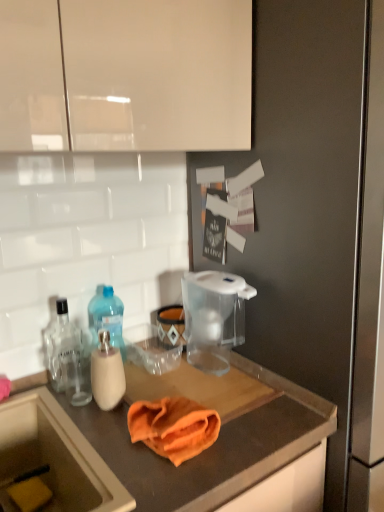
Question: Considering the positions of orange fabric at center and translucent plastic bottle at left, the 1th bottle positioned from the right, in the image, is orange fabric at center wider or thinner than translucent plastic bottle at left, the 1th bottle positioned from the right,?

Choices:
 (A) thin
 (B) wide

Answer: (B)

Question: In the image, is orange fabric at center positioned in front of or behind translucent plastic bottle at left, which is the second bottle in left-to-right order?

Choices:
 (A) behind
 (B) front

Answer: (B)

Question: Based on their relative distances, which object is nearer to the yellow sponge at lower left?

Choices:
 (A) orange microfiber cloth at center
 (B) transparent plastic pitcher at upper center
 (C) orange fabric at center
 (D) translucent plastic bottle at left, which is the second bottle in left-to-right order
 (E) clear glass bottle at left, marked as the 1th bottle in a left-to-right arrangement

Answer: (E)

Question: Considering the real-world distances, which object is farthest from the yellow sponge at lower left?

Choices:
 (A) transparent plastic water filter pitcher at center
 (B) orange microfiber cloth at center
 (C) clear glass bottle at left, marked as the 1th bottle in a left-to-right arrangement
 (D) orange fabric at center
 (E) transparent plastic pitcher at upper center

Answer: (E)